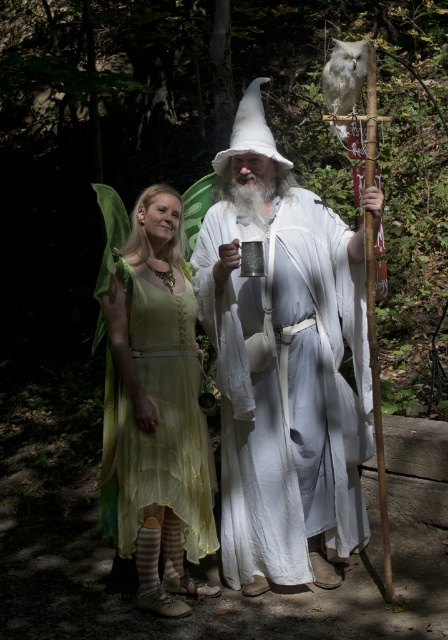
Does white cotton wizard at center appear under matte yellow dress at center?

Actually, white cotton wizard at center is above matte yellow dress at center.

Which of these two, white cotton wizard at center or matte yellow dress at center, stands shorter?

matte yellow dress at center

Is point (280, 528) closer to camera compared to point (119, 314)?

That is False.

Find the location of a particular element. white cotton wizard at center is located at coordinates (284, 365).